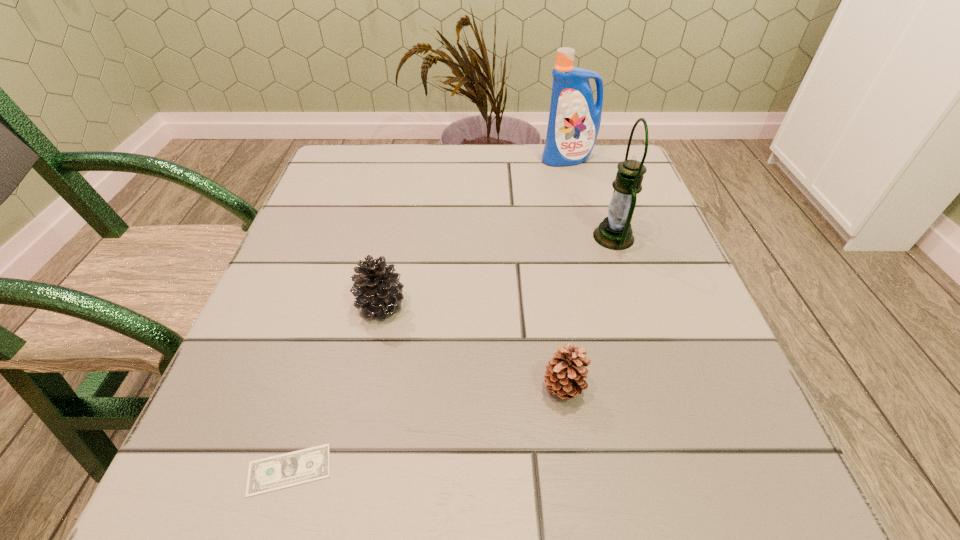
Find the location of a particular element. This screenshot has width=960, height=540. free spot located 0.160m on the side where the fourth nearest object emits light is located at coordinates (514, 237).

The image size is (960, 540). In order to click on vacant space located on the side where the fourth nearest object emits light in this screenshot , I will do `click(414, 237)`.

Identify the location of free space located 0.110m on the front of the left pinecone. The height and width of the screenshot is (540, 960). (365, 384).

You are a GUI agent. You are given a task and a screenshot of the screen. Output one action in this format:
    pyautogui.click(x=<x>, y=<y>)
    Task: Click on the vacant space located on the left of the fourth farthest object
    This screenshot has height=540, width=960.
    Given the screenshot: What is the action you would take?
    pyautogui.click(x=468, y=388)

Where is `vacant space located on the back of the money`? This screenshot has height=540, width=960. vacant space located on the back of the money is located at coordinates (354, 253).

Identify the location of object present at the far edge. The height and width of the screenshot is (540, 960). (574, 121).

Find the location of a particular element. Image resolution: width=960 pixels, height=540 pixels. object that is at the near edge is located at coordinates (273, 473).

Image resolution: width=960 pixels, height=540 pixels. I want to click on object that is at the left edge, so click(x=273, y=473).

Locate an element on the screen. detergent that is at the right edge is located at coordinates (574, 121).

Locate an element on the screen. Image resolution: width=960 pixels, height=540 pixels. lantern present at the right edge is located at coordinates (614, 232).